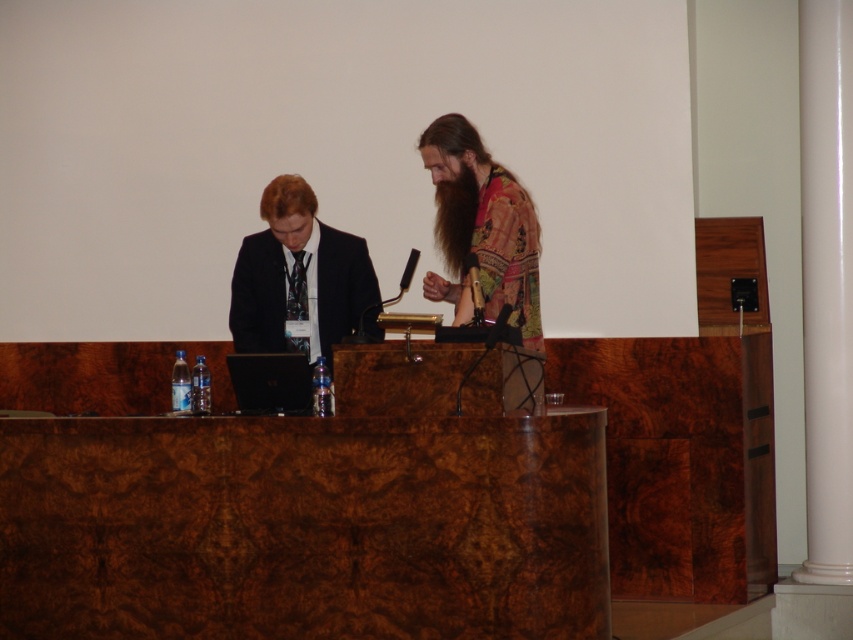
You are attending a conference and need to place your name tag on the podium. The name tag is small and must be placed either on the brown wood table at center or the matte black suit at center. Based on their positions, where should you place it to ensure it is visible to the audience?

The brown wood table at center is to the right of the matte black suit at center, so placing the name tag on the brown wood table at center would make it more visible to the audience as it is positioned further to the right.